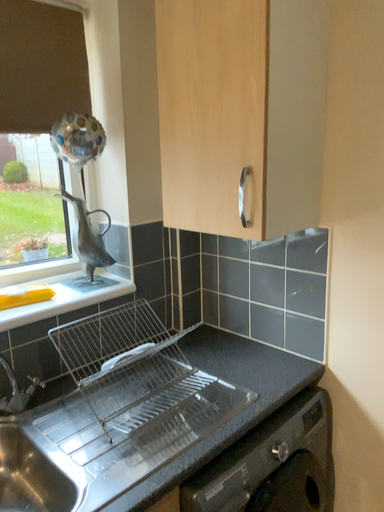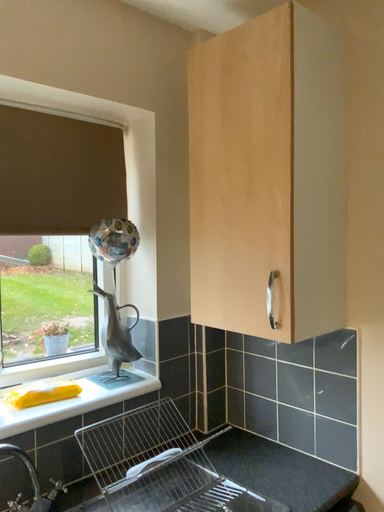
Question: How did the camera likely rotate when shooting the video?

Choices:
 (A) rotated upward
 (B) rotated downward

Answer: (A)